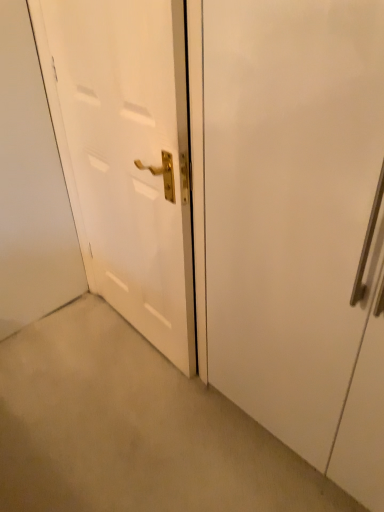
Locate an element on the screen. Image resolution: width=384 pixels, height=512 pixels. white glossy door at center, the second door in the right-to-left sequence is located at coordinates (128, 158).

What is the approximate height of white glossy door at center, arranged as the first door when viewed from the left?

4.15 feet.

This screenshot has height=512, width=384. What do you see at coordinates (128, 158) in the screenshot?
I see `white glossy door at center, the second door in the right-to-left sequence` at bounding box center [128, 158].

Image resolution: width=384 pixels, height=512 pixels. I want to click on white matte door at right, acting as the 2th door starting from the left, so click(x=292, y=206).

What do you see at coordinates (292, 206) in the screenshot? Image resolution: width=384 pixels, height=512 pixels. I see `white matte door at right, acting as the 2th door starting from the left` at bounding box center [292, 206].

I want to click on white glossy door at center, the second door in the right-to-left sequence, so click(x=128, y=158).

Does white glossy door at center, the second door in the right-to-left sequence, appear on the right side of white matte door at right, acting as the 2th door starting from the left?

Incorrect, white glossy door at center, the second door in the right-to-left sequence, is not on the right side of white matte door at right, acting as the 2th door starting from the left.

Is the depth of white glossy door at center, the second door in the right-to-left sequence, less than that of white matte door at right, acting as the first door starting from the right?

That is False.

Considering the positions of points (149, 180) and (278, 55), is point (149, 180) farther from camera compared to point (278, 55)?

Yes, it is.

From the image's perspective, which one is positioned higher, white glossy door at center, the second door in the right-to-left sequence, or white matte door at right, acting as the 2th door starting from the left?

white glossy door at center, the second door in the right-to-left sequence, is shown above in the image.

Consider the image. From a real-world perspective, is white glossy door at center, arranged as the first door when viewed from the left, positioned above or below white matte door at right, acting as the first door starting from the right?

Clearly, from a real-world perspective, white glossy door at center, arranged as the first door when viewed from the left, is below white matte door at right, acting as the first door starting from the right.

In the scene shown: Considering the sizes of objects white glossy door at center, the second door in the right-to-left sequence, and white matte door at right, acting as the first door starting from the right, in the image provided, who is thinner, white glossy door at center, the second door in the right-to-left sequence, or white matte door at right, acting as the first door starting from the right,?

Thinner between the two is white glossy door at center, the second door in the right-to-left sequence.

Is white glossy door at center, the second door in the right-to-left sequence, taller than white matte door at right, acting as the first door starting from the right?

Yes.

Does white glossy door at center, the second door in the right-to-left sequence, have a larger size compared to white matte door at right, acting as the 2th door starting from the left?

No.

Is white matte door at right, acting as the first door starting from the right, inside white glossy door at center, the second door in the right-to-left sequence?

No.

Is there a large distance between white glossy door at center, the second door in the right-to-left sequence, and white matte door at right, acting as the 2th door starting from the left?

white glossy door at center, the second door in the right-to-left sequence, is near white matte door at right, acting as the 2th door starting from the left, not far away.

Is white glossy door at center, the second door in the right-to-left sequence, turned away from white matte door at right, acting as the first door starting from the right?

That's not correct — white glossy door at center, the second door in the right-to-left sequence, is not looking away from white matte door at right, acting as the first door starting from the right.

Can you tell me how much white glossy door at center, arranged as the first door when viewed from the left, and white matte door at right, acting as the first door starting from the right, differ in facing direction?

1.1 degrees separate the facing orientations of white glossy door at center, arranged as the first door when viewed from the left, and white matte door at right, acting as the first door starting from the right.

Where is `door below the white glossy door at center, the second door in the right-to-left sequence (from the image's perspective)`? door below the white glossy door at center, the second door in the right-to-left sequence (from the image's perspective) is located at coordinates (292, 206).

Which object is positioned more to the right, white matte door at right, acting as the first door starting from the right, or white glossy door at center, arranged as the first door when viewed from the left?

From the viewer's perspective, white matte door at right, acting as the first door starting from the right, appears more on the right side.

Which object is further away from the camera taking this photo, white matte door at right, acting as the first door starting from the right, or white glossy door at center, the second door in the right-to-left sequence?

white glossy door at center, the second door in the right-to-left sequence, is further away from the camera.

Which is farther, (233, 208) or (89, 33)?

Point (89, 33)

From the image's perspective, is white matte door at right, acting as the 2th door starting from the left, beneath white glossy door at center, the second door in the right-to-left sequence?

Yes, from the image's perspective, white matte door at right, acting as the 2th door starting from the left, is beneath white glossy door at center, the second door in the right-to-left sequence.

From a real-world perspective, is white matte door at right, acting as the first door starting from the right, physically above white glossy door at center, the second door in the right-to-left sequence?

Yes.

Between white matte door at right, acting as the first door starting from the right, and white glossy door at center, arranged as the first door when viewed from the left, which one has smaller width?

With smaller width is white glossy door at center, arranged as the first door when viewed from the left.

Considering the sizes of objects white matte door at right, acting as the 2th door starting from the left, and white glossy door at center, arranged as the first door when viewed from the left, in the image provided, who is taller, white matte door at right, acting as the 2th door starting from the left, or white glossy door at center, arranged as the first door when viewed from the left,?

Standing taller between the two is white glossy door at center, arranged as the first door when viewed from the left.

Considering the sizes of objects white matte door at right, acting as the 2th door starting from the left, and white glossy door at center, the second door in the right-to-left sequence, in the image provided, who is smaller, white matte door at right, acting as the 2th door starting from the left, or white glossy door at center, the second door in the right-to-left sequence,?

With smaller size is white glossy door at center, the second door in the right-to-left sequence.

Is white matte door at right, acting as the 2th door starting from the left, inside the boundaries of white glossy door at center, the second door in the right-to-left sequence, or outside?

The correct answer is: outside.

Is there a large distance between white matte door at right, acting as the first door starting from the right, and white glossy door at center, arranged as the first door when viewed from the left?

No, white matte door at right, acting as the first door starting from the right, is not far from white glossy door at center, arranged as the first door when viewed from the left.

Does white matte door at right, acting as the first door starting from the right, turn towards white glossy door at center, arranged as the first door when viewed from the left?

No, white matte door at right, acting as the first door starting from the right, is not turned towards white glossy door at center, arranged as the first door when viewed from the left.

From the picture: What's the angular difference between white matte door at right, acting as the 2th door starting from the left, and white glossy door at center, the second door in the right-to-left sequence,'s facing directions?

They differ by 1.1 degrees in their facing directions.

Image resolution: width=384 pixels, height=512 pixels. Find the location of `door that is above the white glossy door at center, arranged as the first door when viewed from the left (from a real-world perspective)`. door that is above the white glossy door at center, arranged as the first door when viewed from the left (from a real-world perspective) is located at coordinates (292, 206).

This screenshot has height=512, width=384. I want to click on door located above the white matte door at right, acting as the 2th door starting from the left (from the image's perspective), so click(128, 158).

You are a GUI agent. You are given a task and a screenshot of the screen. Output one action in this format:
    pyautogui.click(x=<x>, y=<y>)
    Task: Click on the door behind the white matte door at right, acting as the first door starting from the right
    
    Given the screenshot: What is the action you would take?
    pyautogui.click(x=128, y=158)